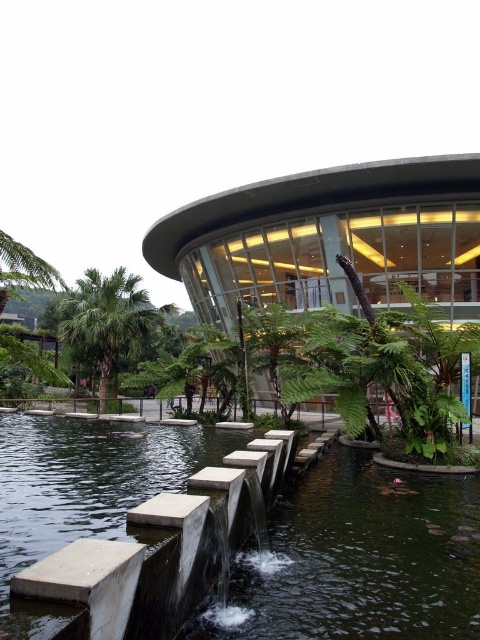
You are standing at the entrance of the modern architectural structure and want to reach the water feature. According to the image, where are the smooth concrete steps at center located in relation to the entrance?

The smooth concrete steps at center are located at point (112, 534) in the image, which would be to the right and slightly forward from the entrance.

You are standing in front of the modern building with the water feature. You see a point labeled as point (112, 534). What is located at that point?

The point (112, 534) corresponds to smooth concrete steps at center.

You are standing in front of the modern building and want to take a photo of the smooth concrete steps at center and the green leafy palm tree at left. Which object should you focus on first if you want to capture both in the frame without moving your camera?

You should focus on the green leafy palm tree at left first because it is taller than the smooth concrete steps at center, so positioning the camera to include its height will also capture the shorter steps in the frame.